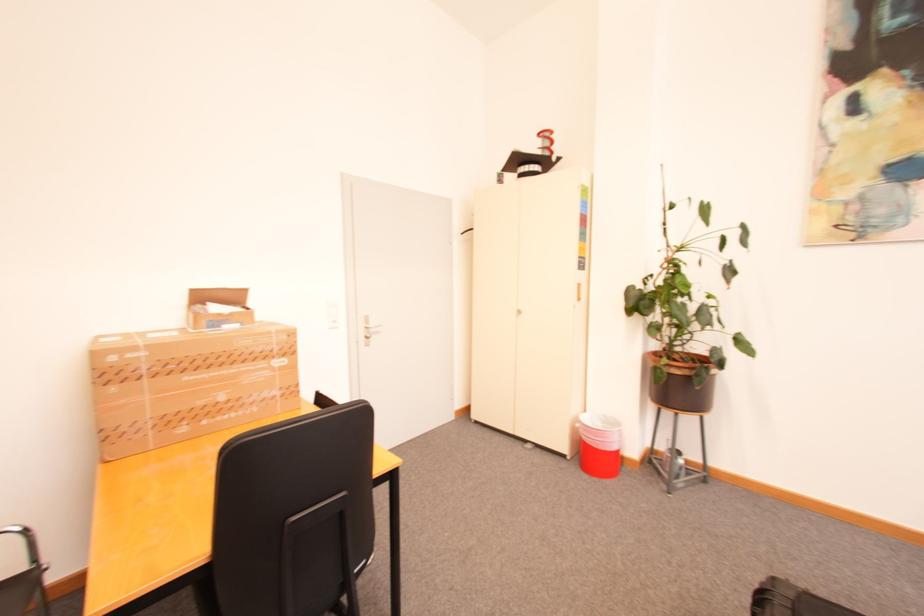
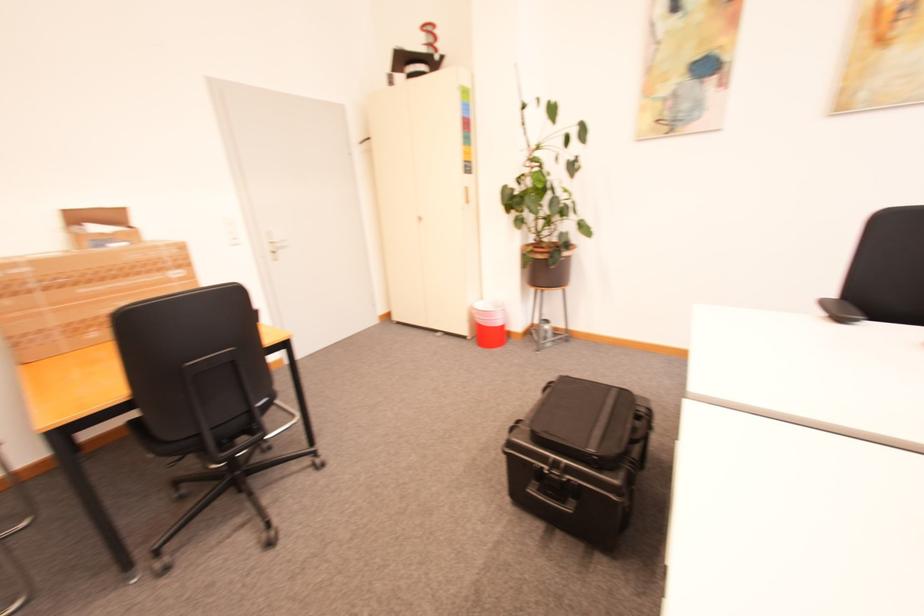
Locate, in the second image, the point that corresponds to the point at 675,366 in the first image.

(539, 253)